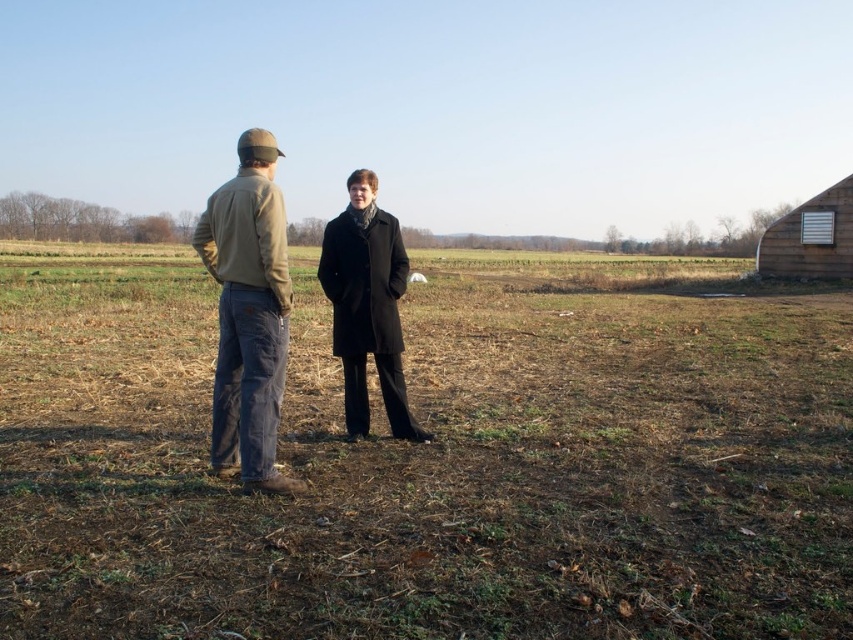
Question: Is brown grass at center below khaki cotton jacket at center?

Choices:
 (A) yes
 (B) no

Answer: (B)

Question: Which point appears closest to the camera in this image?

Choices:
 (A) (241, 268)
 (B) (799, 244)

Answer: (A)

Question: Which point is farther to the camera?

Choices:
 (A) (276, 381)
 (B) (763, 324)
 (C) (799, 211)

Answer: (C)

Question: Where is khaki cotton jacket at center located in relation to wooden barn at right in the image?

Choices:
 (A) below
 (B) above

Answer: (A)

Question: Observing the image, what is the correct spatial positioning of brown grass at center in reference to wooden barn at right?

Choices:
 (A) left
 (B) right

Answer: (A)

Question: Which point appears farthest from the camera in this image?

Choices:
 (A) (798, 273)
 (B) (270, 300)

Answer: (A)